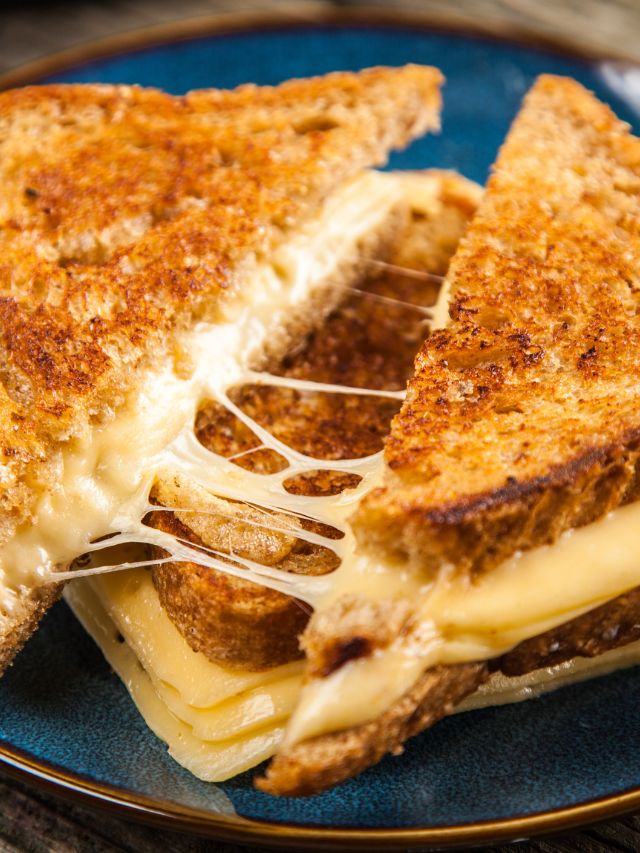
Locate an element on the screen. This screenshot has height=853, width=640. blue plate is located at coordinates (539, 743).